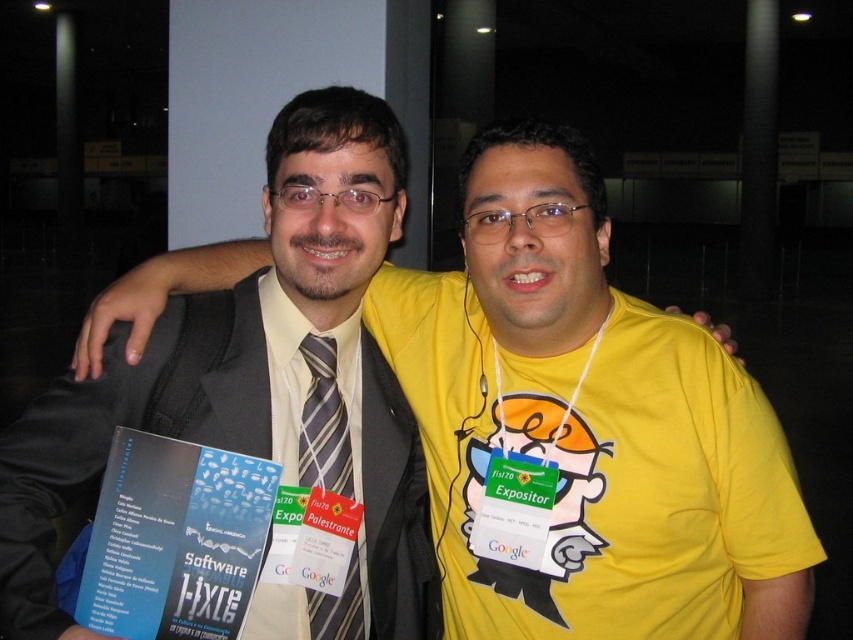
Question: Does yellow matte shirt at center have a greater width compared to striped silk tie at center?

Choices:
 (A) no
 (B) yes

Answer: (B)

Question: Does yellow matte shirt at center appear on the right side of striped silk tie at center?

Choices:
 (A) yes
 (B) no

Answer: (A)

Question: Which point is farther from the camera taking this photo?

Choices:
 (A) (318, 468)
 (B) (566, 525)

Answer: (A)

Question: Is yellow matte shirt at center to the left of striped silk tie at center from the viewer's perspective?

Choices:
 (A) no
 (B) yes

Answer: (A)

Question: Which point is closer to the camera taking this photo?

Choices:
 (A) (329, 365)
 (B) (553, 182)

Answer: (B)